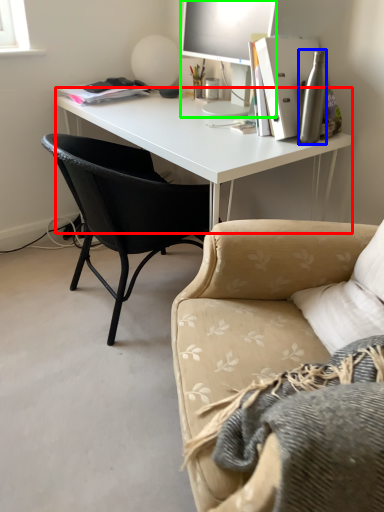
Question: Which is farther away from desk (highlighted by a red box)? bottle (highlighted by a blue box) or television (highlighted by a green box)?

Choices:
 (A) bottle
 (B) television

Answer: (A)